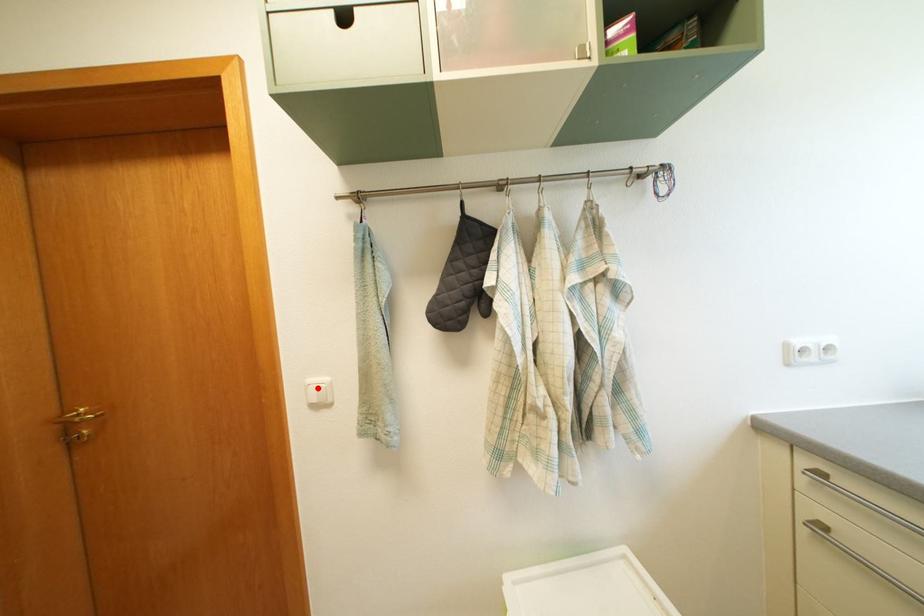
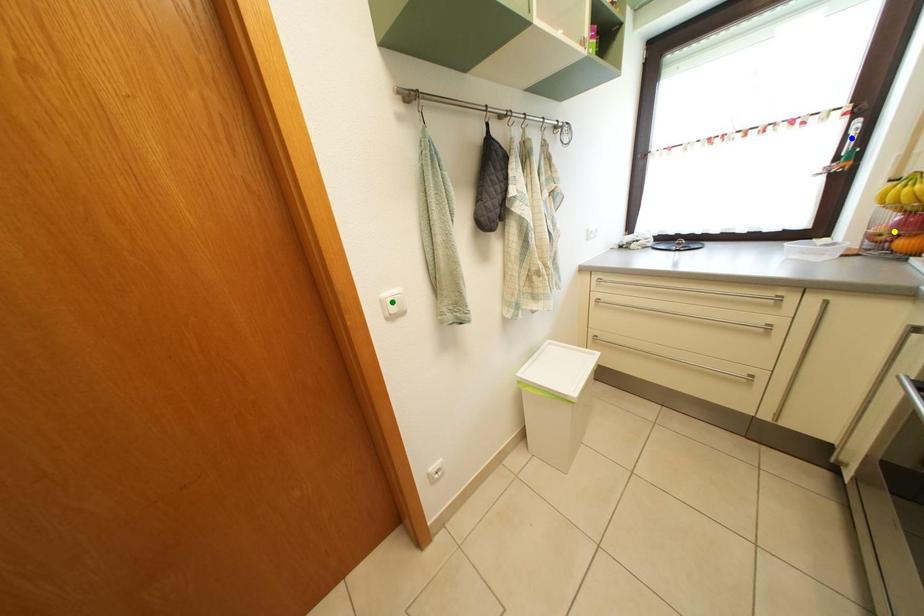
Question: I am providing you with two images of the same scene from different viewpoints. A red point is marked on the first image. You are given multiple points on the second image. Can you choose the point in image 2 that corresponds to the point in image 1?

Choices:
 (A) green point
 (B) blue point
 (C) yellow point

Answer: (A)